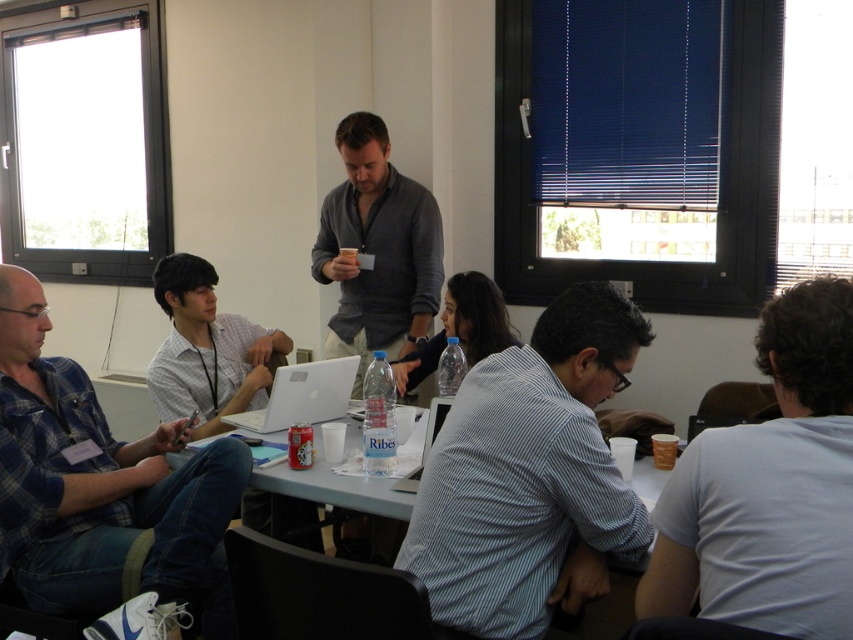
Can you confirm if white plastic table at center is positioned below white plastic laptop at center?

Incorrect, white plastic table at center is not positioned below white plastic laptop at center.

Does white plastic table at center have a greater height compared to white plastic laptop at center?

Yes, white plastic table at center is taller than white plastic laptop at center.

Where is `white plastic table at center`? white plastic table at center is located at coordinates (335, 486).

Locate an element on the screen. white plastic table at center is located at coordinates (335, 486).

Does point (782, 316) come behind point (431, 429)?

That is False.

In the scene shown: Between white cotton shirt at lower right and white plastic laptop at center, which one is positioned lower?

white plastic laptop at center is lower down.

Is point (747, 488) positioned in front of point (419, 467)?

Yes, it is.

Locate an element on the screen. white cotton shirt at lower right is located at coordinates (769, 488).

Does point (422, 333) come behind point (300, 406)?

Yes, it is.

Image resolution: width=853 pixels, height=640 pixels. Identify the location of gray cotton shirt at center. (376, 250).

What do you see at coordinates (376, 250) in the screenshot? I see `gray cotton shirt at center` at bounding box center [376, 250].

At what (x,y) coordinates should I click in order to perform the action: click on gray cotton shirt at center. Please return your answer as a coordinate pair (x, y). Looking at the image, I should click on (376, 250).